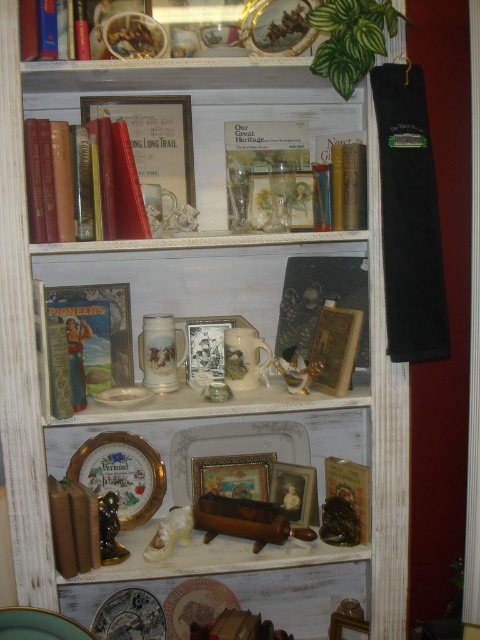
Looking at this image, can you confirm if matte ceramic mug at center is smaller than white glossy plate at center?

Incorrect, matte ceramic mug at center is not smaller in size than white glossy plate at center.

The height and width of the screenshot is (640, 480). What do you see at coordinates (192, 273) in the screenshot? I see `matte ceramic mug at center` at bounding box center [192, 273].

Where is `matte ceramic mug at center`? This screenshot has width=480, height=640. matte ceramic mug at center is located at coordinates (192, 273).

Does point (113, 310) come closer to viewer compared to point (298, 360)?

No.

Does hardcover book at center have a larger size compared to porcelain figurine at center?

Correct, hardcover book at center is larger in size than porcelain figurine at center.

Between point (92, 301) and point (290, 352), which one is positioned behind?

The point (290, 352) is more distant.

Where is `hardcover book at center`? hardcover book at center is located at coordinates (86, 342).

Which is more to the right, matte ceramic mug at center or hardcover book at center?

matte ceramic mug at center

I want to click on matte ceramic mug at center, so click(x=192, y=273).